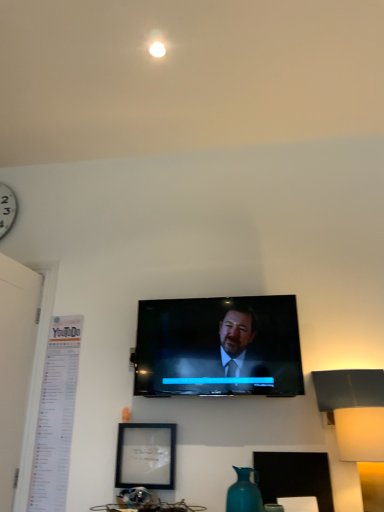
Question: Is matte black tv at center in contact with matte black picture frame at lower center?

Choices:
 (A) yes
 (B) no

Answer: (B)

Question: Can you confirm if matte black tv at center is taller than matte black picture frame at lower center?

Choices:
 (A) no
 (B) yes

Answer: (B)

Question: Is matte black picture frame at lower center at the back of matte black tv at center?

Choices:
 (A) yes
 (B) no

Answer: (B)

Question: Does matte black tv at center lie behind matte black picture frame at lower center?

Choices:
 (A) no
 (B) yes

Answer: (A)

Question: Is there a large distance between matte black tv at center and matte black picture frame at lower center?

Choices:
 (A) no
 (B) yes

Answer: (A)

Question: From a real-world perspective, is matte black picture frame at lower center positioned above or below teal ceramic vase at lower center?

Choices:
 (A) below
 (B) above

Answer: (B)

Question: In terms of width, does matte black picture frame at lower center look wider or thinner when compared to teal ceramic vase at lower center?

Choices:
 (A) wide
 (B) thin

Answer: (B)

Question: Would you say matte black picture frame at lower center is inside or outside teal ceramic vase at lower center?

Choices:
 (A) inside
 (B) outside

Answer: (B)

Question: Considering the positions of matte black picture frame at lower center and teal ceramic vase at lower center in the image, is matte black picture frame at lower center bigger or smaller than teal ceramic vase at lower center?

Choices:
 (A) small
 (B) big

Answer: (A)

Question: From their relative heights in the image, would you say white matte table lamp at right is taller or shorter than matte black tv at center?

Choices:
 (A) tall
 (B) short

Answer: (B)

Question: Based on their positions, is white matte table lamp at right located to the left or right of matte black tv at center?

Choices:
 (A) right
 (B) left

Answer: (A)

Question: Considering the positions of white matte table lamp at right and matte black tv at center in the image, is white matte table lamp at right wider or thinner than matte black tv at center?

Choices:
 (A) thin
 (B) wide

Answer: (B)

Question: Considering their positions, is white matte table lamp at right located in front of or behind matte black tv at center?

Choices:
 (A) front
 (B) behind

Answer: (A)

Question: Relative to white matte table lamp at right, is matte black picture frame at lower center in front or behind?

Choices:
 (A) front
 (B) behind

Answer: (B)

Question: From the image's perspective, is matte black picture frame at lower center positioned above or below white matte table lamp at right?

Choices:
 (A) below
 (B) above

Answer: (A)